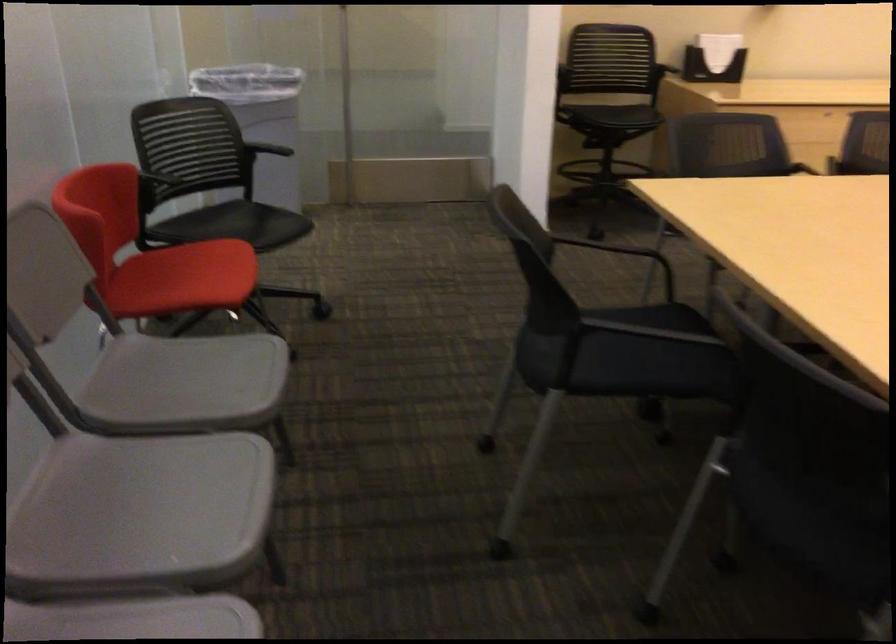
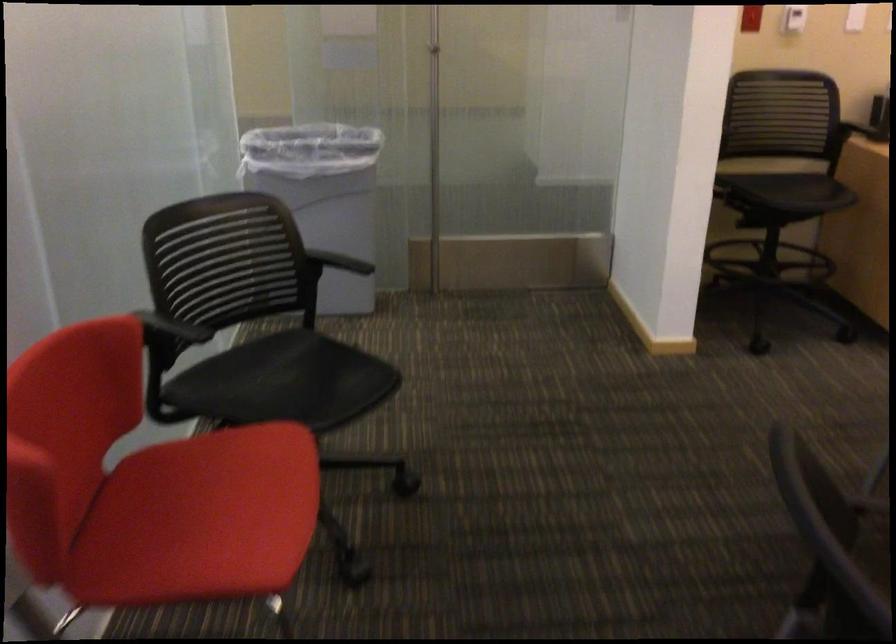
Locate, in the second image, the point that corresponds to point 257,111 in the first image.

(323, 196)